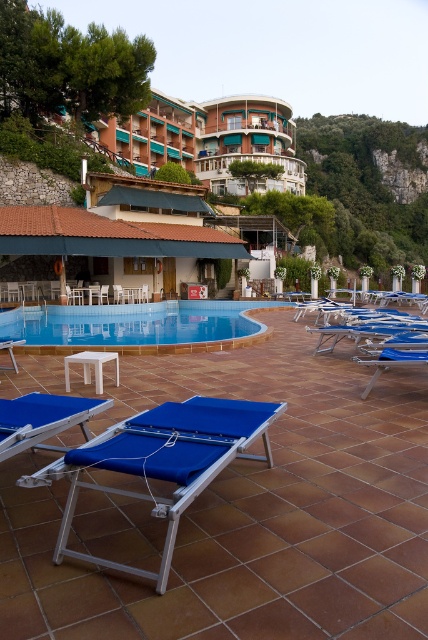
You are standing on the tiled patio and want to walk directly to the blue glossy pool at center. Which direction should you walk to reach it?

The blue glossy pool at center is located at point (133, 324) in the scene, so you should walk towards the center of the image to reach it.

You are standing at the point with coordinates point (23, 406) and want to walk to the point with coordinates point (371, 262). Will you have to walk past any obstacles along the way?

Point (371, 262) is behind point (23, 406), so yes, you will have to walk past point (23, 406) to reach point (371, 262).

You are standing on the tiled patio and want to take a photo of the green leafy hillside at upper right while sitting on the blue fabric beach chair at lower left. Is the hillside visible from that position?

The green leafy hillside at upper right is to the right of the blue fabric beach chair at lower left, so yes, the hillside is visible from the chair.